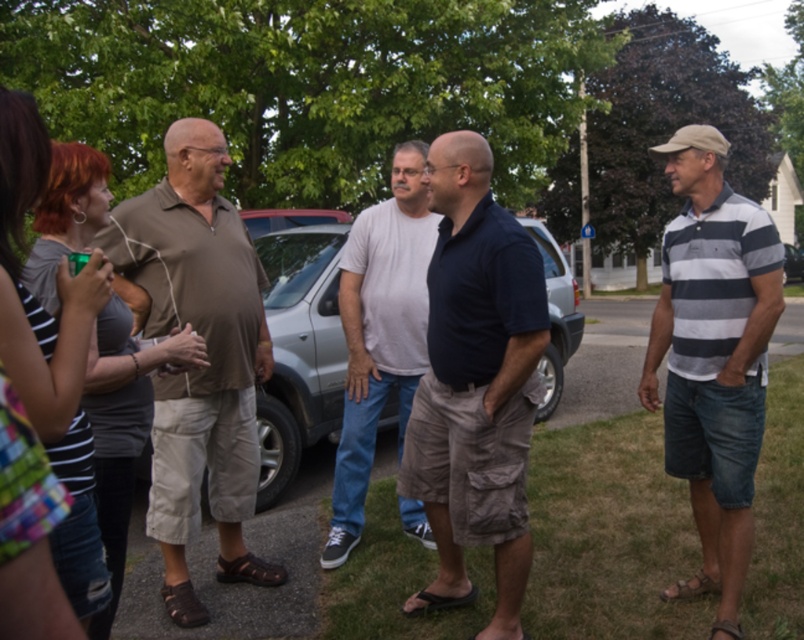
Can you confirm if white cotton shirt at center is shorter than silver metallic suv at center?

No, white cotton shirt at center is not shorter than silver metallic suv at center.

Who is lower down, white cotton shirt at center or silver metallic suv at center?

white cotton shirt at center is lower down.

Identify the location of white cotton shirt at center. This screenshot has width=804, height=640. (380, 332).

Who is shorter, dark blue cotton polo shirt at center or metallic silver car at center?

With less height is dark blue cotton polo shirt at center.

Who is more forward, (x=458, y=422) or (x=800, y=268)?

Point (x=458, y=422)

Locate an element on the screen. Image resolution: width=804 pixels, height=640 pixels. dark blue cotton polo shirt at center is located at coordinates (474, 384).

Is white cotton shirt at center to the right of metallic silver car at center from the viewer's perspective?

Incorrect, white cotton shirt at center is not on the right side of metallic silver car at center.

Does white cotton shirt at center have a greater height compared to metallic silver car at center?

In fact, white cotton shirt at center may be shorter than metallic silver car at center.

You are a GUI agent. You are given a task and a screenshot of the screen. Output one action in this format:
    pyautogui.click(x=<x>, y=<y>)
    Task: Click on the white cotton shirt at center
    The height and width of the screenshot is (640, 804).
    Given the screenshot: What is the action you would take?
    pyautogui.click(x=380, y=332)

You are a GUI agent. You are given a task and a screenshot of the screen. Output one action in this format:
    pyautogui.click(x=<x>, y=<y>)
    Task: Click on the white cotton shirt at center
    
    Given the screenshot: What is the action you would take?
    pyautogui.click(x=380, y=332)